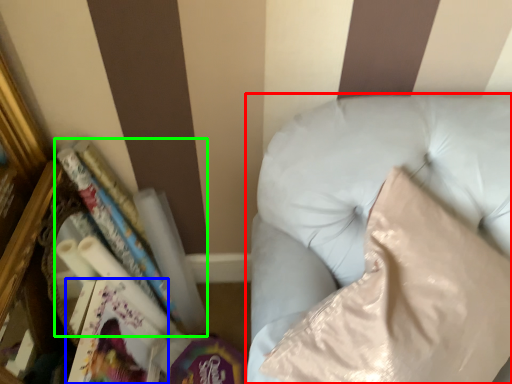
Question: Which object is positioned farthest from furniture (highlighted by a red box)? Select from paperback book (highlighted by a blue box) and book (highlighted by a green box).

Choices:
 (A) paperback book
 (B) book

Answer: (A)